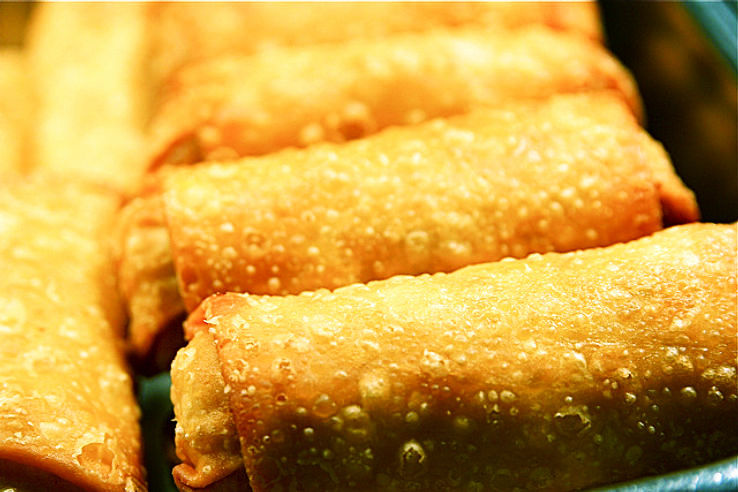
Identify the location of surface. Image resolution: width=738 pixels, height=492 pixels. (150, 444).